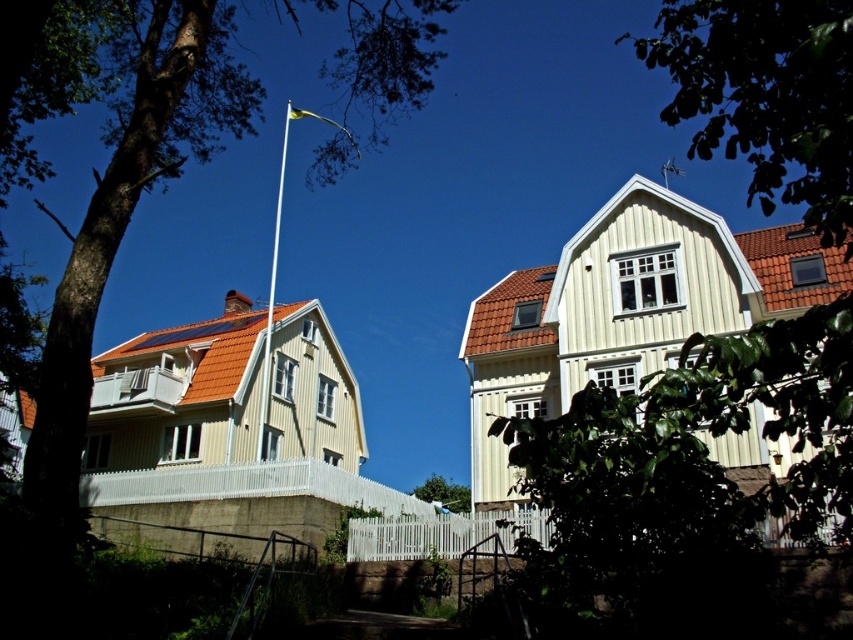
You are a bird looking for a place to perch. You see the brown textured tree at upper left and the metallic flagpole at upper center. Which one is located below the other?

The brown textured tree at upper left is positioned under the metallic flagpole at upper center, so the tree is below the flagpole.